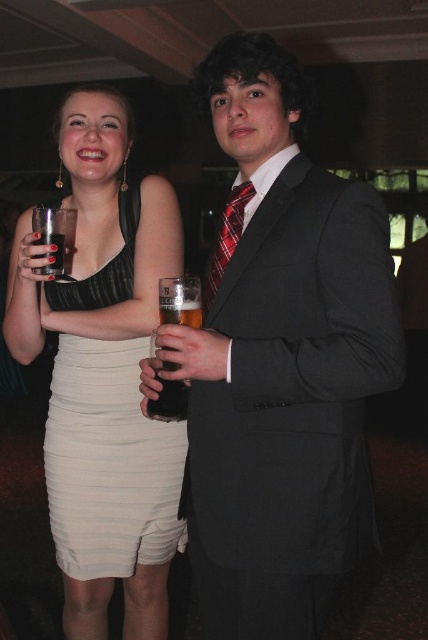
You are a photographer at a formal event. You need to capture a photo of the red plaid tie at center and the clear glass at upper left. Which object is positioned higher in the image?

The red plaid tie at center is located above the clear glass at upper left, so it is positioned higher in the image.

You are at a formal event and see the point marked at coordinates (281, 365). What object is located exactly at this point?

The object located exactly at point (281, 365) is the matte black suit at center.